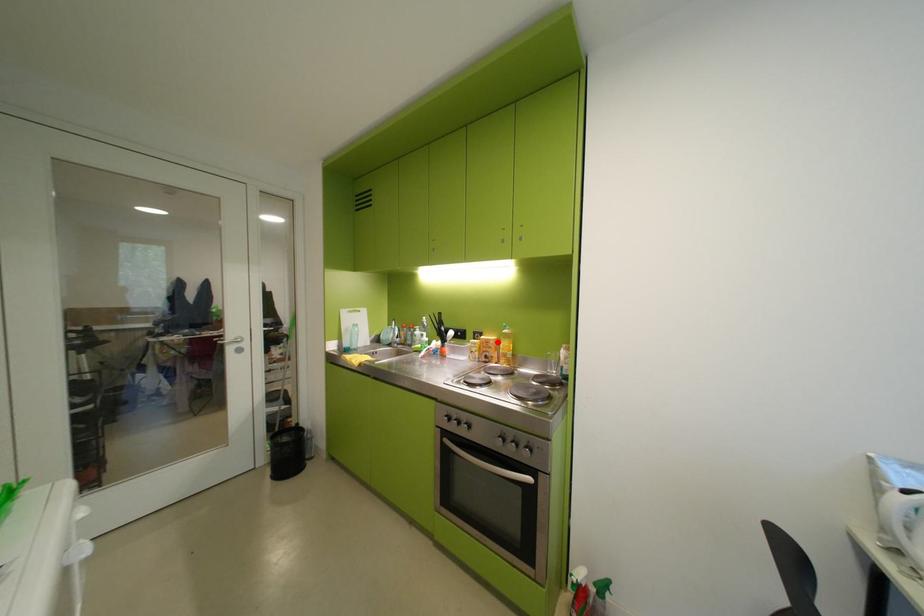
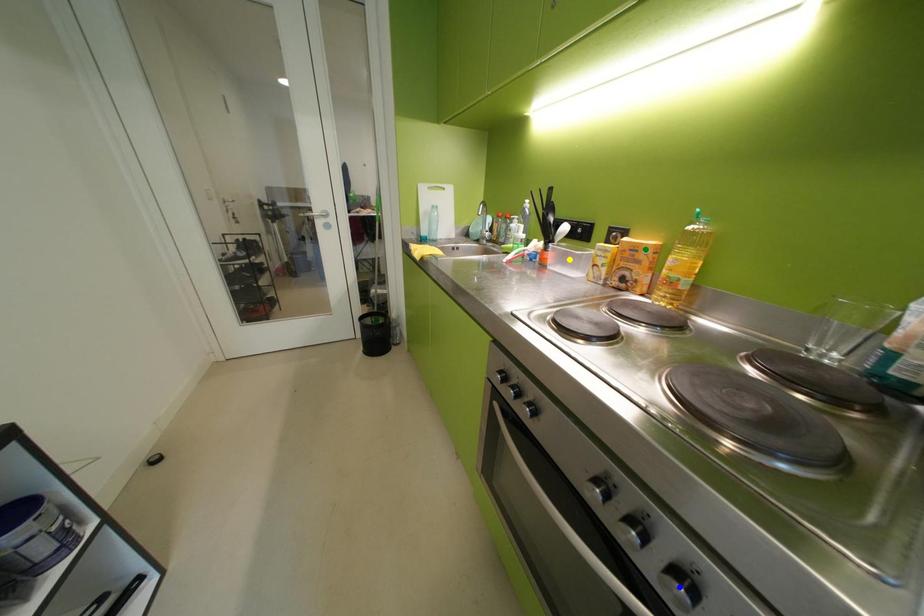
Question: I am providing you with two images of the same scene from different viewpoints. A red point is marked on the first image. You are given multiple points on the second image. In image 2, which mark is for the same physical point as the one in image 1?

Choices:
 (A) blue point
 (B) green point
 (C) yellow point

Answer: (B)